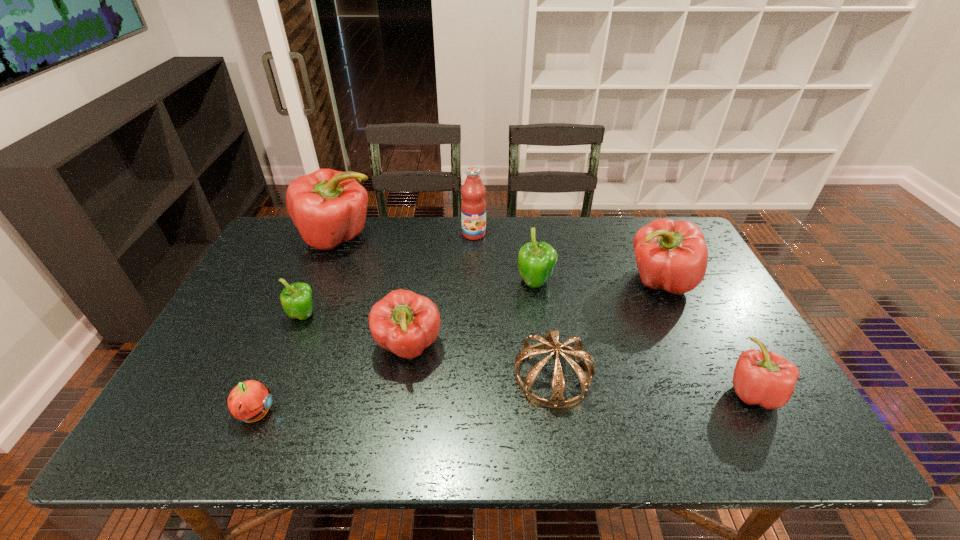
Identify the location of vacant space located on the left of the smallest pink bell pepper. This screenshot has height=540, width=960. (617, 392).

Locate an element on the screen. The height and width of the screenshot is (540, 960). vacant point located 0.160m on the right of the apple is located at coordinates (346, 413).

This screenshot has width=960, height=540. What are the coordinates of `bell pepper located at the far edge` in the screenshot? It's located at (329, 207).

The height and width of the screenshot is (540, 960). What are the coordinates of `fruit juice positioned at the far edge` in the screenshot? It's located at (473, 205).

Where is `bell pepper at the near edge`? bell pepper at the near edge is located at coordinates (764, 378).

At what (x,y) coordinates should I click in order to perform the action: click on apple present at the near edge. Please return your answer as a coordinate pair (x, y). This screenshot has height=540, width=960. Looking at the image, I should click on (250, 400).

Where is `bell pepper at the left edge`? bell pepper at the left edge is located at coordinates (329, 207).

Where is `apple positioned at the left edge`? apple positioned at the left edge is located at coordinates point(250,400).

Where is `object that is at the far left corner`? object that is at the far left corner is located at coordinates (329, 207).

The height and width of the screenshot is (540, 960). I want to click on object situated at the near left corner, so click(250, 400).